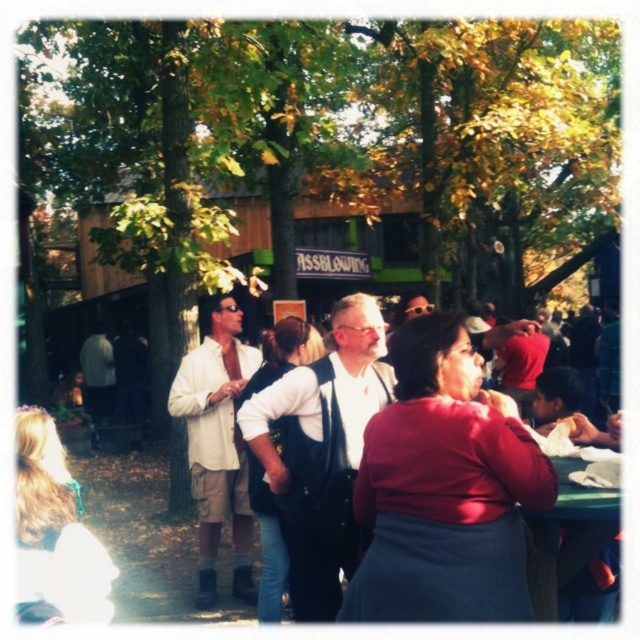
You are standing at the point marked as point [337,140] in the image. What object is located at that point?

The point [337,140] corresponds to the green leafy tree at center.

You are standing at the camera position and want to know how far the point at coordinates (x=472, y=412) is from you. Can you determine the distance?

The distance of point (x=472, y=412) from the camera is 3.11 meters.